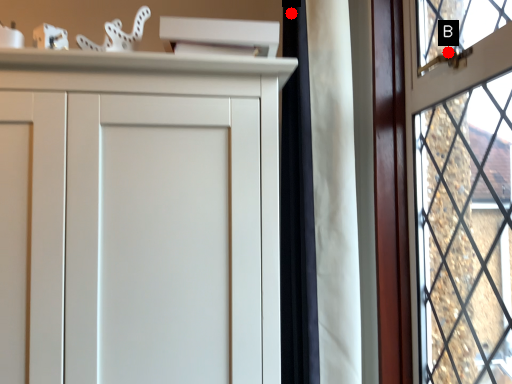
Question: Two points are circled on the image, labeled by A and B beside each circle. Which point is farther to the camera?

Choices:
 (A) A is further
 (B) B is further

Answer: (A)